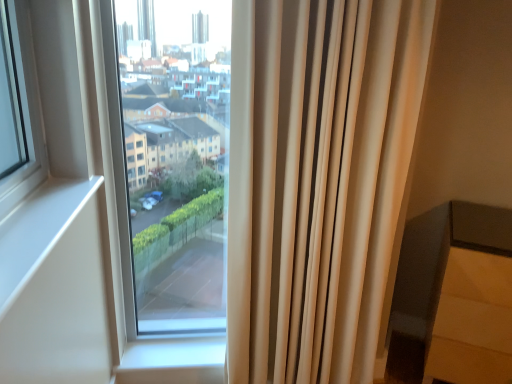
Locate an element on the screen. The image size is (512, 384). matte gray chair at lower right is located at coordinates (472, 299).

The height and width of the screenshot is (384, 512). Describe the element at coordinates (318, 181) in the screenshot. I see `beige fabric curtain at right` at that location.

Find the location of `matte gray chair at lower right`. matte gray chair at lower right is located at coordinates (472, 299).

Is point (382, 27) positioned behind point (152, 133)?

No, it is not.

Can you see beige fabric curtain at right touching transparent glass window at center?

No, beige fabric curtain at right is not next to transparent glass window at center.

From a real-world perspective, is beige fabric curtain at right beneath transparent glass window at center?

Yes, from a real-world perspective, beige fabric curtain at right is beneath transparent glass window at center.

Could you tell me if beige fabric curtain at right is facing transparent glass window at center?

No, beige fabric curtain at right is not oriented towards transparent glass window at center.

Relative to matte gray chair at lower right, is transparent glass window at center in front or behind?

transparent glass window at center is positioned closer to the viewer than matte gray chair at lower right.

From the image's perspective, which is above, transparent glass window at center or matte gray chair at lower right?

transparent glass window at center appears higher in the image.

Is transparent glass window at center not near matte gray chair at lower right?

Yes, transparent glass window at center is far from matte gray chair at lower right.

How far apart are transparent glass window at center and matte gray chair at lower right?

transparent glass window at center and matte gray chair at lower right are 1.76 meters apart from each other.

From a real-world perspective, between matte gray chair at lower right and transparent glass window at center, who is vertically lower?

In real-world perspective, matte gray chair at lower right is lower.

What's the angular difference between matte gray chair at lower right and transparent glass window at center's facing directions?

The facing directions of matte gray chair at lower right and transparent glass window at center are 27.6 degrees apart.

Consider the image. Considering the relative positions of matte gray chair at lower right and transparent glass window at center in the image provided, is matte gray chair at lower right to the right of transparent glass window at center from the viewer's perspective?

Correct, you'll find matte gray chair at lower right to the right of transparent glass window at center.

Is transparent glass window at center situated inside beige fabric curtain at right or outside?

transparent glass window at center is not enclosed by beige fabric curtain at right.

Considering the relative sizes of transparent glass window at center and beige fabric curtain at right in the image provided, is transparent glass window at center taller than beige fabric curtain at right?

No.

Is transparent glass window at center not close to beige fabric curtain at right?

transparent glass window at center is far away from beige fabric curtain at right.

From the image's perspective, is beige fabric curtain at right above or below matte gray chair at lower right?

beige fabric curtain at right is situated higher than matte gray chair at lower right in the image.

Can you confirm if beige fabric curtain at right is smaller than matte gray chair at lower right?

Correct, beige fabric curtain at right occupies less space than matte gray chair at lower right.

Considering the positions of objects beige fabric curtain at right and matte gray chair at lower right in the image provided, who is more to the right, beige fabric curtain at right or matte gray chair at lower right?

From the viewer's perspective, matte gray chair at lower right appears more on the right side.

Who is taller, matte gray chair at lower right or beige fabric curtain at right?

beige fabric curtain at right.

What's the angular difference between matte gray chair at lower right and beige fabric curtain at right's facing directions?

The angle between the facing direction of matte gray chair at lower right and the facing direction of beige fabric curtain at right is 27.6 degrees.

From the picture: Is matte gray chair at lower right next to beige fabric curtain at right?

No.

There is a matte gray chair at lower right. Where is `curtain above it (from a real-world perspective)`? curtain above it (from a real-world perspective) is located at coordinates (318, 181).

This screenshot has width=512, height=384. I want to click on curtain located in front of the transparent glass window at center, so click(x=318, y=181).

This screenshot has height=384, width=512. In order to click on furniture behind the transparent glass window at center in this screenshot , I will do `click(472, 299)`.

Estimate the real-world distances between objects in this image. Which object is further from beige fabric curtain at right, matte gray chair at lower right or transparent glass window at center?

transparent glass window at center lies further to beige fabric curtain at right than the other object.

Looking at the image, which one is located closer to transparent glass window at center, matte gray chair at lower right or beige fabric curtain at right?

The object closer to transparent glass window at center is beige fabric curtain at right.

Which object lies further to the anchor point transparent glass window at center, beige fabric curtain at right or matte gray chair at lower right?

Based on the image, matte gray chair at lower right appears to be further to transparent glass window at center.

Estimate the real-world distances between objects in this image. Which object is further from beige fabric curtain at right, transparent glass window at center or matte gray chair at lower right?

Based on the image, transparent glass window at center appears to be further to beige fabric curtain at right.

Considering their positions, is beige fabric curtain at right positioned further to matte gray chair at lower right than transparent glass window at center?

transparent glass window at center is positioned further to the anchor matte gray chair at lower right.

From the image, which object appears to be nearer to matte gray chair at lower right, transparent glass window at center or beige fabric curtain at right?

beige fabric curtain at right lies closer to matte gray chair at lower right than the other object.

The width and height of the screenshot is (512, 384). In order to click on curtain between transparent glass window at center and matte gray chair at lower right in this screenshot , I will do `click(318, 181)`.